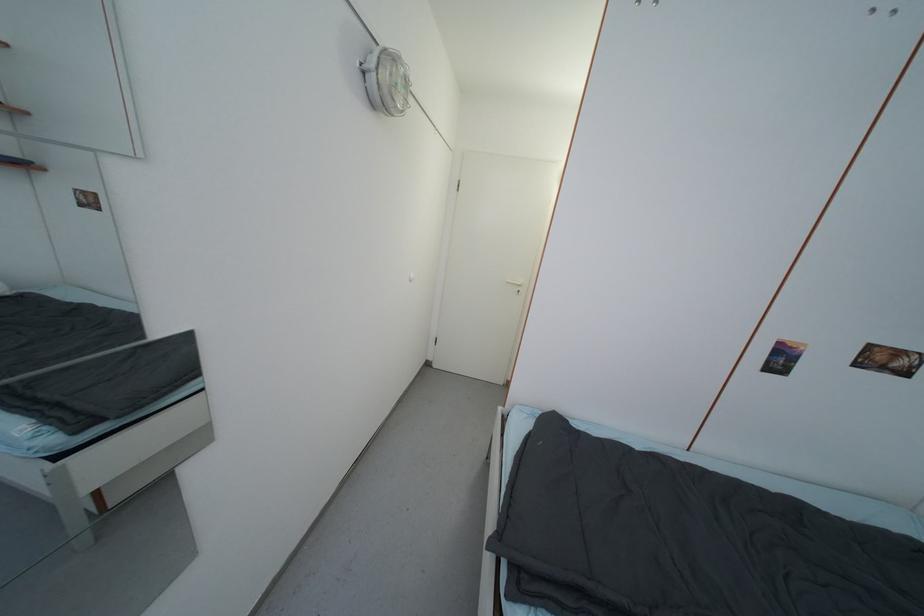
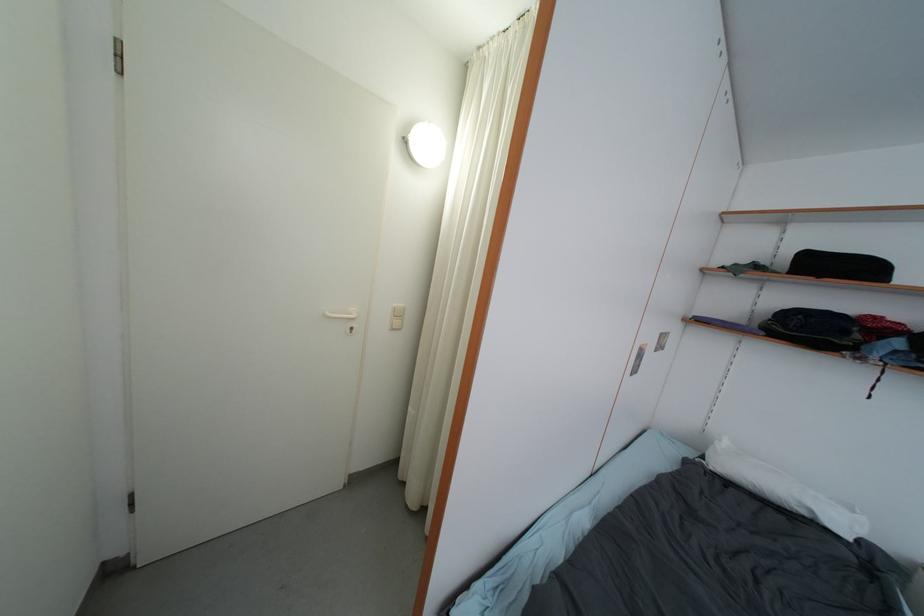
Question: The camera is either moving clockwise (left) or counter-clockwise (right) around the object. The first image is from the beginning of the video and the second image is from the end. Is the camera moving left or right when shooting the video?

Choices:
 (A) Left
 (B) Right

Answer: (A)